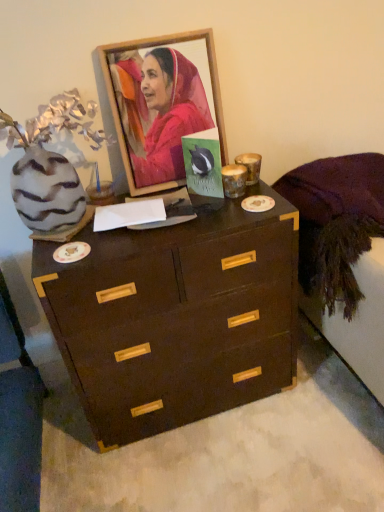
Question: Does point (185, 136) appear closer or farther from the camera than point (337, 230)?

Choices:
 (A) closer
 (B) farther

Answer: (A)

Question: In terms of size, does green matte postcard at center appear bigger or smaller than purple fabric at right?

Choices:
 (A) big
 (B) small

Answer: (B)

Question: Which is nearer to the dark wood chest of drawers at center?

Choices:
 (A) green matte postcard at center
 (B) wooden picture frame at upper center
 (C) purple fabric at right

Answer: (C)

Question: Considering the real-world distances, which object is closest to the dark wood chest of drawers at center?

Choices:
 (A) wooden picture frame at upper center
 (B) green matte postcard at center
 (C) purple fabric at right

Answer: (C)